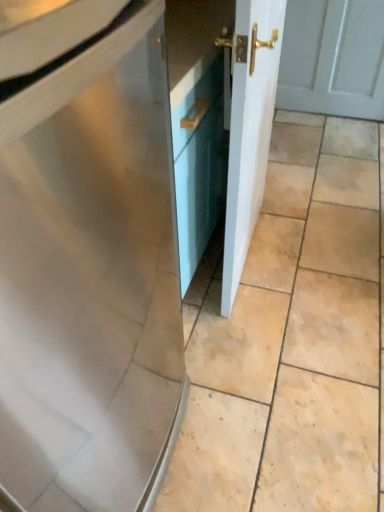
You are a GUI agent. You are given a task and a screenshot of the screen. Output one action in this format:
    pyautogui.click(x=<x>, y=<y>)
    Task: Click on the white glossy door at center
    The width and height of the screenshot is (384, 512).
    Given the screenshot: What is the action you would take?
    pyautogui.click(x=249, y=128)

Describe the element at coordinates (249, 128) in the screenshot. I see `white glossy door at center` at that location.

Image resolution: width=384 pixels, height=512 pixels. Describe the element at coordinates (292, 338) in the screenshot. I see `beige matte tile at center` at that location.

The image size is (384, 512). In order to click on beige matte tile at center in this screenshot , I will do `click(292, 338)`.

In order to click on white glossy door at center in this screenshot , I will do `click(249, 128)`.

Does white glossy door at center appear on the right side of beige matte tile at center?

Yes.

Is the depth of white glossy door at center greater than that of beige matte tile at center?

No, white glossy door at center is in front of beige matte tile at center.

Does point (247, 108) appear closer or farther from the camera than point (187, 435)?

Point (247, 108) is positioned closer to the camera compared to point (187, 435).

From the image's perspective, is white glossy door at center on top of beige matte tile at center?

Correct, white glossy door at center appears higher than beige matte tile at center in the image.

From a real-world perspective, which is physically above, white glossy door at center or beige matte tile at center?

white glossy door at center is physically above.

Which object is thinner, white glossy door at center or beige matte tile at center?

white glossy door at center is thinner.

Which of these two, white glossy door at center or beige matte tile at center, stands shorter?

beige matte tile at center is shorter.

Between white glossy door at center and beige matte tile at center, which one has smaller size?

With smaller size is white glossy door at center.

Is white glossy door at center spatially inside beige matte tile at center, or outside of it?

white glossy door at center is spatially situated outside beige matte tile at center.

Is white glossy door at center positioned far away from beige matte tile at center?

No, white glossy door at center is not far from beige matte tile at center.

Is white glossy door at center aimed at beige matte tile at center?

No, white glossy door at center is not facing towards beige matte tile at center.

How different are the orientations of white glossy door at center and beige matte tile at center in degrees?

The facing directions of white glossy door at center and beige matte tile at center are 179 degrees apart.

I want to click on ceramic tile that is on the left side of white glossy door at center, so click(x=292, y=338).

Does beige matte tile at center appear on the left side of white glossy door at center?

Yes, beige matte tile at center is to the left of white glossy door at center.

Is the position of beige matte tile at center more distant than that of white glossy door at center?

Yes, beige matte tile at center is further from the camera.

Does point (349, 175) lie in front of point (255, 121)?

No, it is not.

From the image's perspective, which is below, beige matte tile at center or white glossy door at center?

beige matte tile at center appears lower in the image.

From a real-world perspective, between beige matte tile at center and white glossy door at center, who is vertically lower?

beige matte tile at center, from a real-world perspective.

Is beige matte tile at center wider or thinner than white glossy door at center?

beige matte tile at center is wider than white glossy door at center.

Considering the sizes of beige matte tile at center and white glossy door at center in the image, is beige matte tile at center taller or shorter than white glossy door at center?

beige matte tile at center is shorter than white glossy door at center.

Is beige matte tile at center bigger than white glossy door at center?

Yes.

Choose the correct answer: Is beige matte tile at center inside white glossy door at center or outside it?

beige matte tile at center is not inside white glossy door at center, it's outside.

Are beige matte tile at center and white glossy door at center located far from each other?

No, beige matte tile at center is not far away from white glossy door at center.

Is beige matte tile at center turned away from white glossy door at center?

No, beige matte tile at center is not facing away from white glossy door at center.

Can you tell me how much beige matte tile at center and white glossy door at center differ in facing direction?

179 degrees separate the facing orientations of beige matte tile at center and white glossy door at center.

Where is `ceramic tile on the left side of white glossy door at center`? ceramic tile on the left side of white glossy door at center is located at coordinates (292, 338).

The width and height of the screenshot is (384, 512). What are the coordinates of `door that appears in front of the beige matte tile at center` in the screenshot? It's located at (249, 128).

Where is `door above the beige matte tile at center (from the image's perspective)`? The width and height of the screenshot is (384, 512). door above the beige matte tile at center (from the image's perspective) is located at coordinates (249, 128).